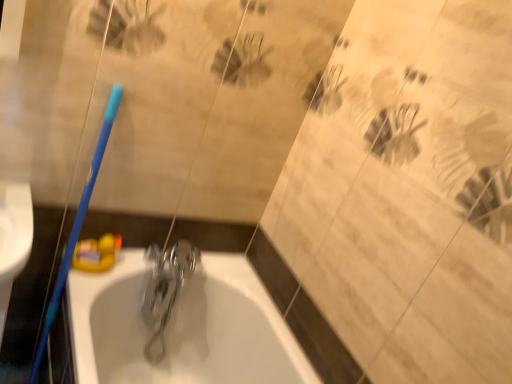
Question: From the image's perspective, is polished metallic faucet at center below blue plastic toothbrush at left?

Choices:
 (A) no
 (B) yes

Answer: (B)

Question: Could blue plastic toothbrush at left be considered to be inside polished metallic faucet at center?

Choices:
 (A) no
 (B) yes

Answer: (A)

Question: From a real-world perspective, is polished metallic faucet at center located higher than blue plastic toothbrush at left?

Choices:
 (A) no
 (B) yes

Answer: (A)

Question: Can you confirm if polished metallic faucet at center is bigger than blue plastic toothbrush at left?

Choices:
 (A) no
 (B) yes

Answer: (A)

Question: From the image's perspective, would you say polished metallic faucet at center is positioned over blue plastic toothbrush at left?

Choices:
 (A) no
 (B) yes

Answer: (A)

Question: From a real-world perspective, is polished metallic faucet at center beneath blue plastic toothbrush at left?

Choices:
 (A) yes
 (B) no

Answer: (A)

Question: From the image's perspective, would you say blue plastic toothbrush at left is positioned over polished metallic faucet at center?

Choices:
 (A) yes
 (B) no

Answer: (A)

Question: Is blue plastic toothbrush at left aimed at polished metallic faucet at center?

Choices:
 (A) yes
 (B) no

Answer: (B)

Question: Does blue plastic toothbrush at left have a lesser height compared to polished metallic faucet at center?

Choices:
 (A) no
 (B) yes

Answer: (A)

Question: From a real-world perspective, is blue plastic toothbrush at left on top of polished metallic faucet at center?

Choices:
 (A) no
 (B) yes

Answer: (B)

Question: Would you say blue plastic toothbrush at left is outside polished metallic faucet at center?

Choices:
 (A) no
 (B) yes

Answer: (B)

Question: Does blue plastic toothbrush at left appear on the right side of polished metallic faucet at center?

Choices:
 (A) yes
 (B) no

Answer: (B)

Question: Is polished metallic faucet at center positioned in front of white glossy bathtub at center?

Choices:
 (A) yes
 (B) no

Answer: (B)